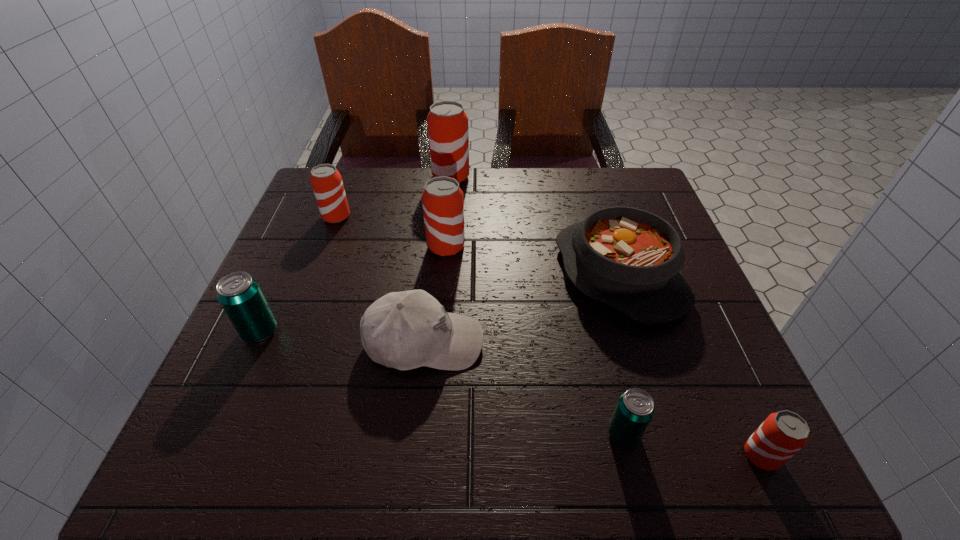
Find the location of a particular element. the farthest object is located at coordinates (448, 133).

What are the coordinates of `the biggest orange beer can` in the screenshot? It's located at (448, 133).

Where is `the third farthest beer can`? the third farthest beer can is located at coordinates (443, 204).

Image resolution: width=960 pixels, height=540 pixels. What are the coordinates of `the second biggest orange beer can` in the screenshot? It's located at click(x=443, y=204).

This screenshot has width=960, height=540. In order to click on the third biggest orange beer can in this screenshot , I will do `click(326, 181)`.

You are a GUI agent. You are given a task and a screenshot of the screen. Output one action in this format:
    pyautogui.click(x=<x>, y=<y>)
    Task: Click on the second farthest beer can
    The height and width of the screenshot is (540, 960).
    Given the screenshot: What is the action you would take?
    pyautogui.click(x=326, y=181)

I want to click on the farther teal beer can, so click(x=240, y=295).

Identify the location of the bigger teal beer can. (240, 295).

Where is `casserole`? This screenshot has height=540, width=960. casserole is located at coordinates (630, 259).

This screenshot has width=960, height=540. Identify the location of baseball cap. (405, 330).